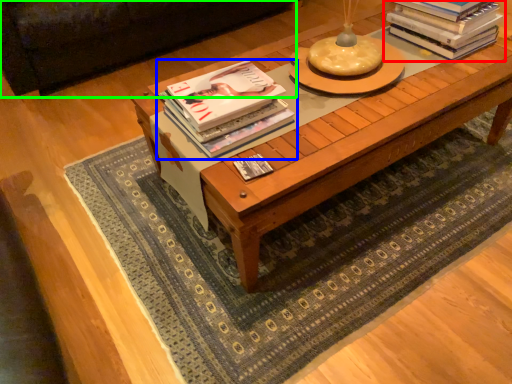
Question: Based on their relative distances, which object is farther from book (highlighted by a red box)? Choose from book (highlighted by a blue box) and couch (highlighted by a green box).

Choices:
 (A) book
 (B) couch

Answer: (B)